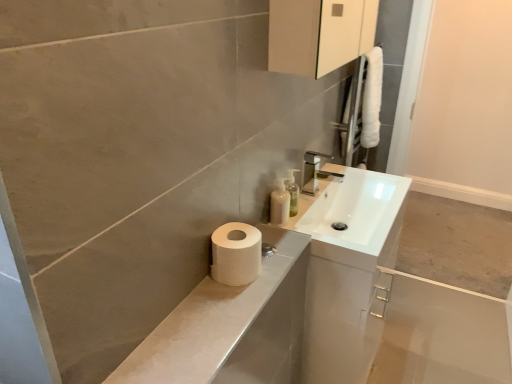
Question: Is white matte toilet paper at lower left at the left side of translucent plastic soap dispenser at upper center?

Choices:
 (A) no
 (B) yes

Answer: (B)

Question: Can you confirm if white matte toilet paper at lower left is shorter than translucent plastic soap dispenser at upper center?

Choices:
 (A) yes
 (B) no

Answer: (A)

Question: Would you say white matte toilet paper at lower left is outside translucent plastic soap dispenser at upper center?

Choices:
 (A) yes
 (B) no

Answer: (A)

Question: Considering the relative positions of white matte toilet paper at lower left and translucent plastic soap dispenser at upper center in the image provided, is white matte toilet paper at lower left to the right of translucent plastic soap dispenser at upper center from the viewer's perspective?

Choices:
 (A) no
 (B) yes

Answer: (A)

Question: Is there a large distance between white matte toilet paper at lower left and translucent plastic soap dispenser at upper center?

Choices:
 (A) no
 (B) yes

Answer: (A)

Question: Based on their positions, is translucent plastic soap dispenser at upper right located to the left or right of white matte toilet paper at lower left?

Choices:
 (A) left
 (B) right

Answer: (B)

Question: Considering the positions of translucent plastic soap dispenser at upper right and white matte toilet paper at lower left in the image, is translucent plastic soap dispenser at upper right taller or shorter than white matte toilet paper at lower left?

Choices:
 (A) tall
 (B) short

Answer: (A)

Question: Choose the correct answer: Is translucent plastic soap dispenser at upper right inside white matte toilet paper at lower left or outside it?

Choices:
 (A) outside
 (B) inside

Answer: (A)

Question: Is translucent plastic soap dispenser at upper right wider or thinner than white matte toilet paper at lower left?

Choices:
 (A) wide
 (B) thin

Answer: (B)

Question: Is white matte toilet paper at lower left wider or thinner than translucent plastic soap dispenser at upper center?

Choices:
 (A) wide
 (B) thin

Answer: (A)

Question: Considering the positions of white matte toilet paper at lower left and translucent plastic soap dispenser at upper center in the image, is white matte toilet paper at lower left taller or shorter than translucent plastic soap dispenser at upper center?

Choices:
 (A) short
 (B) tall

Answer: (A)

Question: From a real-world perspective, is white matte toilet paper at lower left above or below translucent plastic soap dispenser at upper center?

Choices:
 (A) above
 (B) below

Answer: (A)

Question: Based on their positions, is white matte toilet paper at lower left located to the left or right of translucent plastic soap dispenser at upper center?

Choices:
 (A) left
 (B) right

Answer: (A)

Question: In terms of height, does translucent plastic soap dispenser at upper center look taller or shorter compared to white matte toilet paper at lower left?

Choices:
 (A) short
 (B) tall

Answer: (B)

Question: In terms of size, does translucent plastic soap dispenser at upper center appear bigger or smaller than white matte toilet paper at lower left?

Choices:
 (A) big
 (B) small

Answer: (B)